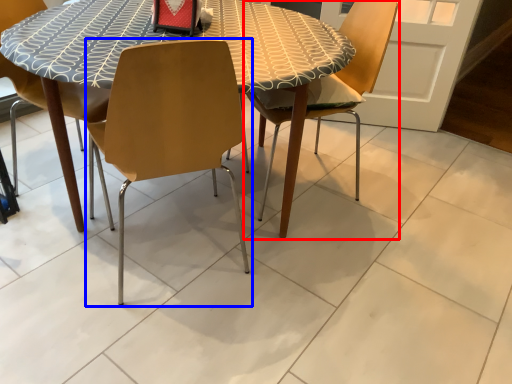
Question: Which object is further to the camera taking this photo, chair (highlighted by a red box) or chair (highlighted by a blue box)?

Choices:
 (A) chair
 (B) chair

Answer: (A)